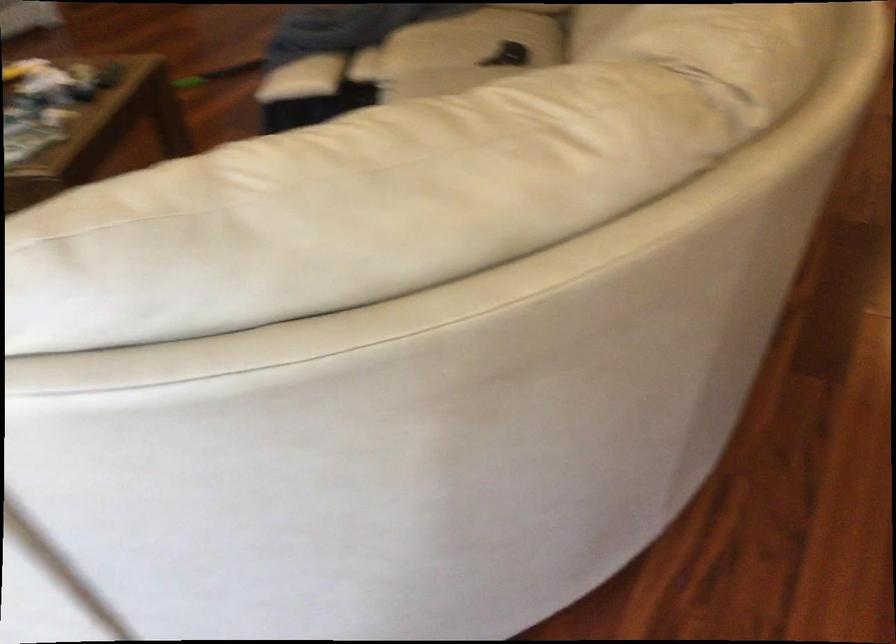
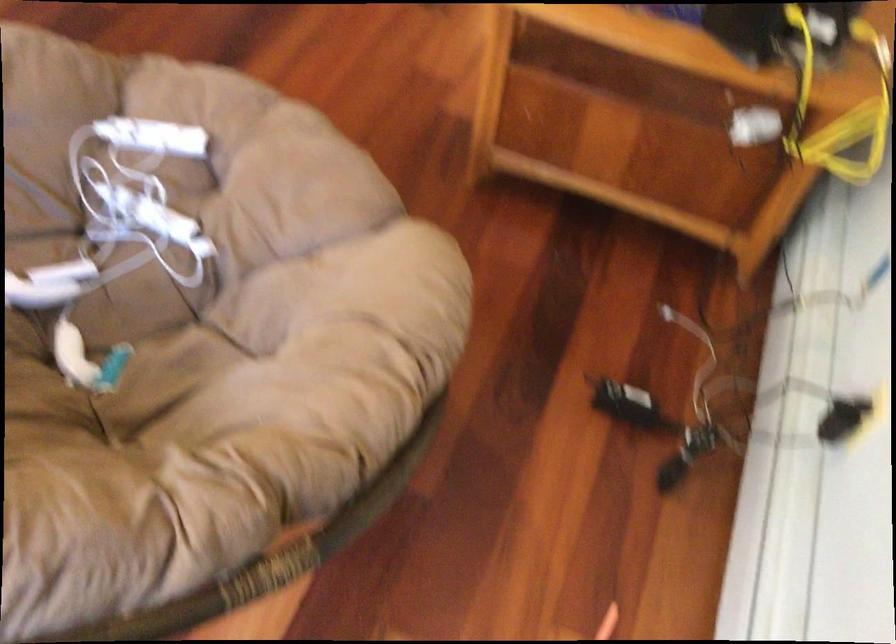
The images are taken continuously from a first-person perspective. In which direction are you moving?

The movement direction of the cameraman is right, backward.